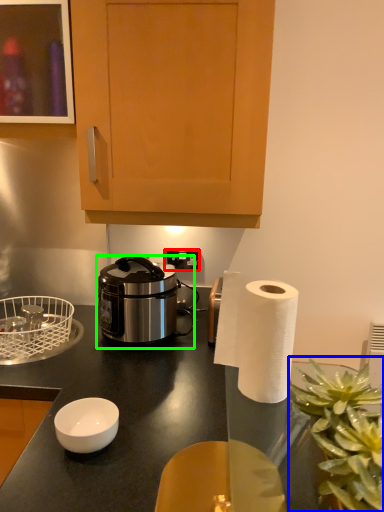
Question: Which object is positioned farthest from power outlet (highlighted by a red box)? Select from plant (highlighted by a blue box) and rice cooker (highlighted by a green box).

Choices:
 (A) plant
 (B) rice cooker

Answer: (A)